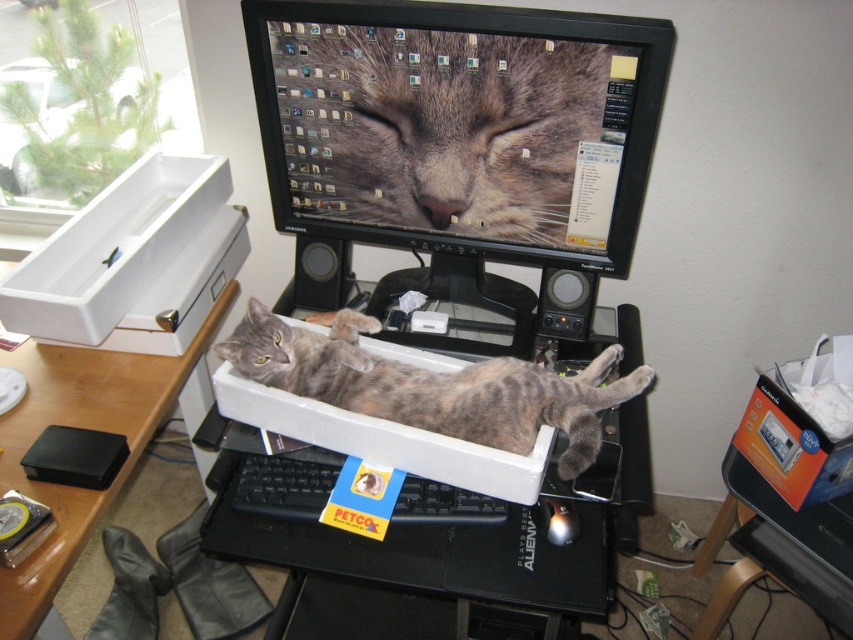
From the picture: Is white plastic box at left wider than gray fur cat at center?

Incorrect, white plastic box at left's width does not surpass gray fur cat at center's.

Between white plastic box at left and gray fur cat at center, which one has less height?

Standing shorter between the two is gray fur cat at center.

Which is behind, point (143, 225) or point (605, 356)?

Positioned behind is point (143, 225).

Image resolution: width=853 pixels, height=640 pixels. In order to click on white plastic box at left in this screenshot , I will do `click(132, 260)`.

Is white plastic box at left taller than orange cardboard box at lower right?

Correct, white plastic box at left is much taller as orange cardboard box at lower right.

Is white plastic box at left above orange cardboard box at lower right?

Yes, white plastic box at left is above orange cardboard box at lower right.

Image resolution: width=853 pixels, height=640 pixels. What are the coordinates of `white plastic box at left` in the screenshot? It's located at (132, 260).

Find the location of a particular element. This screenshot has width=853, height=640. white plastic box at left is located at coordinates (132, 260).

What do you see at coordinates (457, 125) in the screenshot?
I see `black glossy monitor at upper center` at bounding box center [457, 125].

Who is more distant from viewer, [473,168] or [486,419]?

Positioned behind is point [473,168].

Is point (451, 104) closer to camera compared to point (538, 397)?

No, it is not.

The image size is (853, 640). I want to click on black glossy monitor at upper center, so click(x=457, y=125).